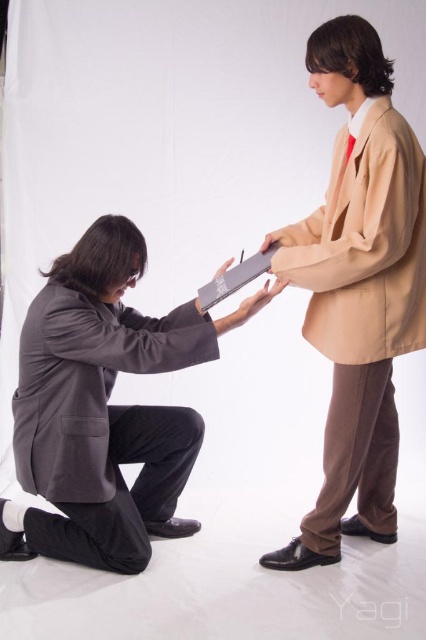
Question: Is dark gray wool business suit at lower left below matte gray paper at center?

Choices:
 (A) yes
 (B) no

Answer: (A)

Question: Considering the real-world distances, which object is closest to the beige fabric business suit at upper right?

Choices:
 (A) matte gray paper at center
 (B) dark gray wool business suit at lower left

Answer: (A)

Question: Is dark gray wool business suit at lower left below matte gray paper at center?

Choices:
 (A) yes
 (B) no

Answer: (A)

Question: Considering the relative positions of dark gray wool business suit at lower left and matte gray paper at center in the image provided, where is dark gray wool business suit at lower left located with respect to matte gray paper at center?

Choices:
 (A) above
 (B) below

Answer: (B)

Question: Which of these objects is positioned closest to the beige fabric business suit at upper right?

Choices:
 (A) dark gray wool business suit at lower left
 (B) matte gray paper at center

Answer: (B)

Question: Among these points, which one is nearest to the camera?

Choices:
 (A) (115, 356)
 (B) (275, 289)
 (C) (333, 307)

Answer: (A)